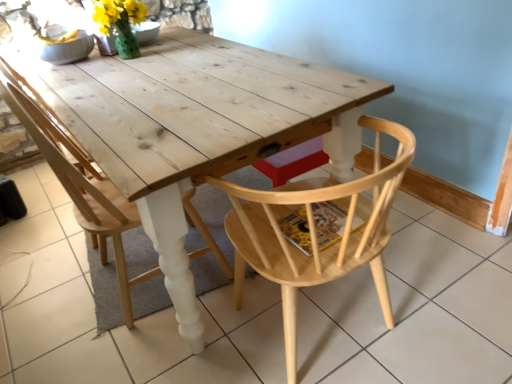
The image size is (512, 384). I want to click on free space to the left of natural wood chair at center, arranged as the 1th chair when viewed from the left, so click(48, 292).